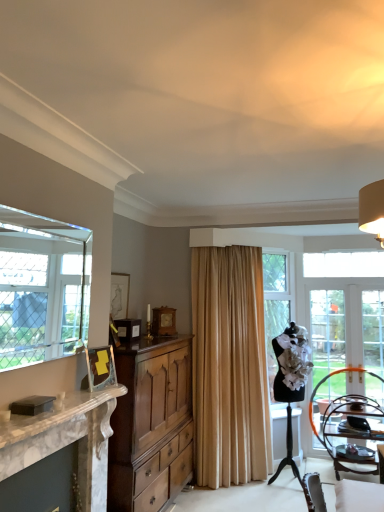
Question: Considering the positions of beige fabric curtain at center and wooden chair at lower right in the image, is beige fabric curtain at center wider or thinner than wooden chair at lower right?

Choices:
 (A) wide
 (B) thin

Answer: (B)

Question: Looking at the image, does beige fabric curtain at center seem bigger or smaller compared to wooden chair at lower right?

Choices:
 (A) big
 (B) small

Answer: (A)

Question: Which is farther from the clear glass door at right?

Choices:
 (A) wooden chair at lower right
 (B) white marble fireplace at left
 (C) beige fabric curtain at center
 (D) wooden cabinet at center-left
 (E) clear glass window at left

Answer: (E)

Question: Based on their relative distances, which object is farther from the wooden cabinet at center-left?

Choices:
 (A) clear glass door at right
 (B) clear glass window at left
 (C) wooden chair at lower right
 (D) beige fabric curtain at center
 (E) white marble fireplace at left

Answer: (A)